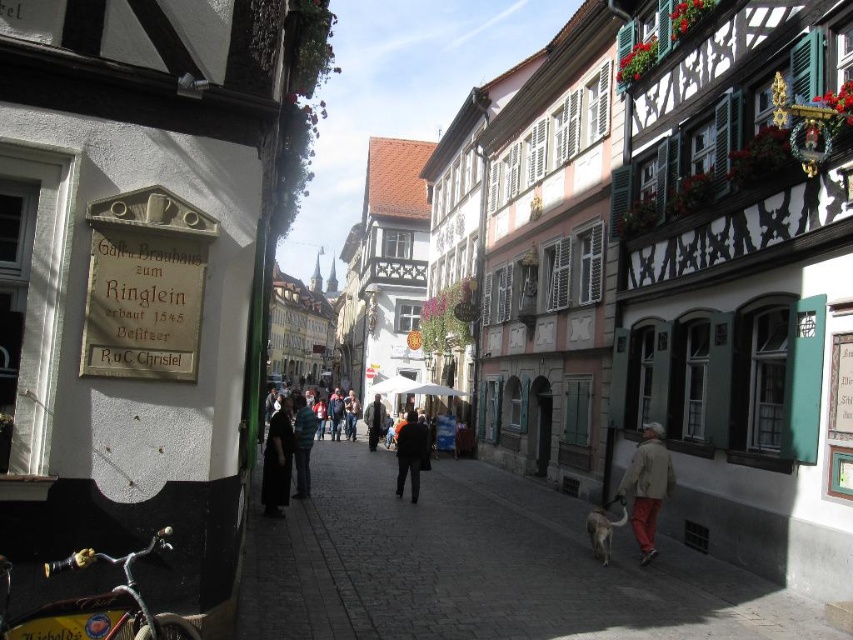
Is dark fabric coat at center above green striped shirt at center?

Actually, dark fabric coat at center is below green striped shirt at center.

Is point (277, 412) less distant than point (303, 400)?

Yes, point (277, 412) is closer to viewer.

Find the location of a particular element. Image resolution: width=853 pixels, height=640 pixels. dark fabric coat at center is located at coordinates (277, 460).

Can you confirm if light brown wooden sidewalk at center is positioned to the right of dark fabric coat at center?

Correct, you'll find light brown wooden sidewalk at center to the right of dark fabric coat at center.

At what (x,y) coordinates should I click in order to perform the action: click on light brown wooden sidewalk at center. Please return your answer as a coordinate pair (x, y). Looking at the image, I should click on (480, 566).

Describe the element at coordinates (647, 486) in the screenshot. I see `light brown jacket at lower right` at that location.

Is point (621, 493) positioned after point (280, 465)?

No, it is not.

This screenshot has height=640, width=853. Describe the element at coordinates (647, 486) in the screenshot. I see `light brown jacket at lower right` at that location.

I want to click on light brown jacket at lower right, so click(x=647, y=486).